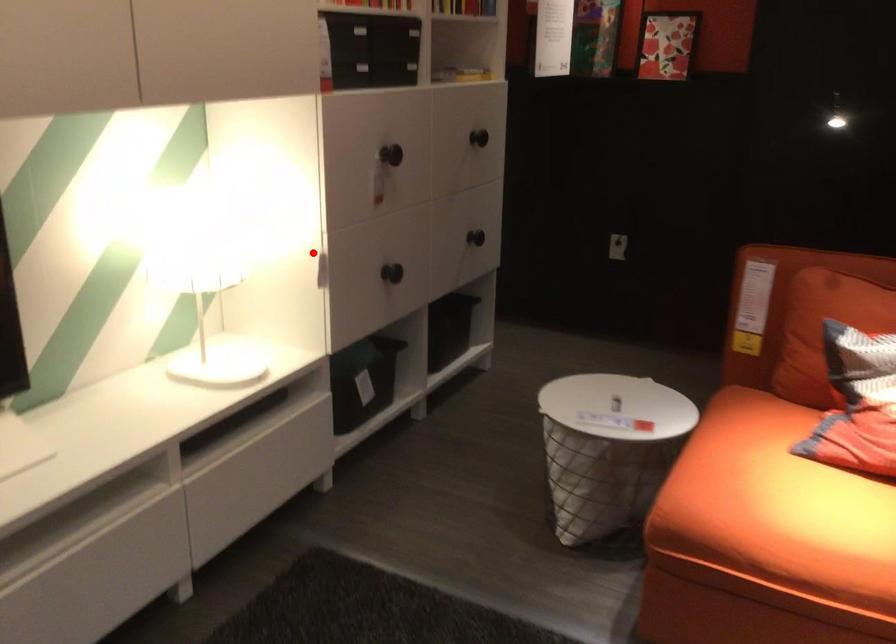
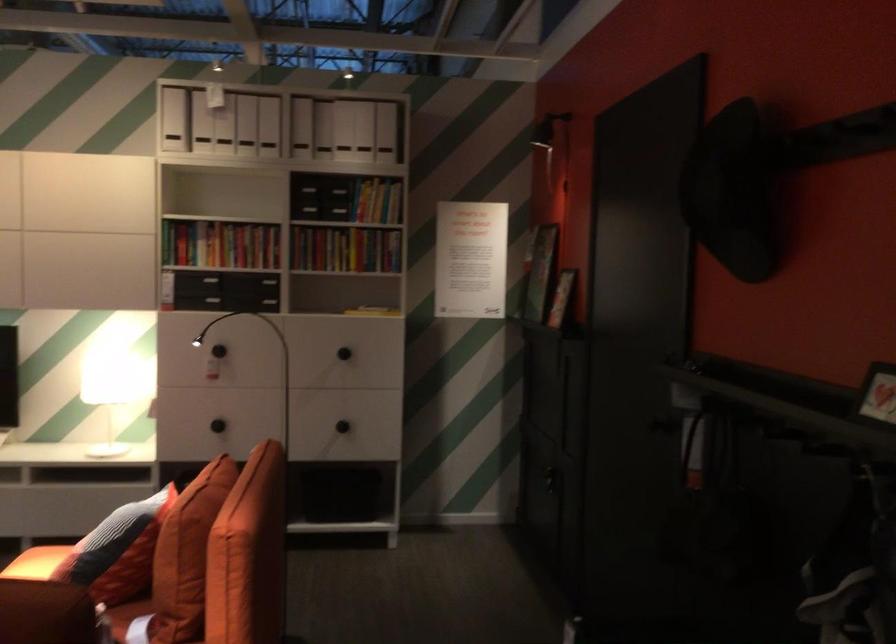
Question: I am providing you with two images of the same scene from different viewpoints. A red point is marked on the first image. Is the red point's position out of view in image 2?

Choices:
 (A) Yes
 (B) No

Answer: (B)